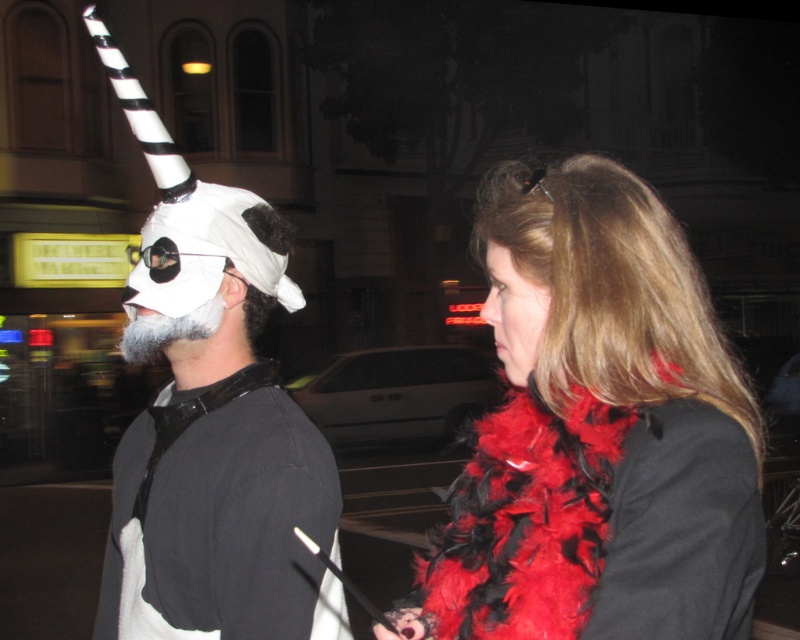
Is feather boa at right positioned at the back of smooth red scarf at right?

No, feather boa at right is in front of smooth red scarf at right.

Does feather boa at right appear over smooth red scarf at right?

No, feather boa at right is not above smooth red scarf at right.

Does point (472, 560) lie behind point (536, 310)?

That is True.

This screenshot has width=800, height=640. I want to click on feather boa at right, so click(598, 429).

Is white matte mask at left to the right of smooth red scarf at right from the viewer's perspective?

In fact, white matte mask at left is to the left of smooth red scarf at right.

The width and height of the screenshot is (800, 640). What are the coordinates of `white matte mask at left` in the screenshot? It's located at (222, 518).

This screenshot has height=640, width=800. I want to click on white matte mask at left, so click(222, 518).

Can you confirm if feather boa at right is smaller than white matte mask at left?

Actually, feather boa at right might be larger than white matte mask at left.

Does feather boa at right have a lesser height compared to white matte mask at left?

In fact, feather boa at right may be taller than white matte mask at left.

I want to click on feather boa at right, so 598,429.

At what (x,y) coordinates should I click in order to perform the action: click on feather boa at right. Please return your answer as a coordinate pair (x, y). Image resolution: width=800 pixels, height=640 pixels. Looking at the image, I should click on (598, 429).